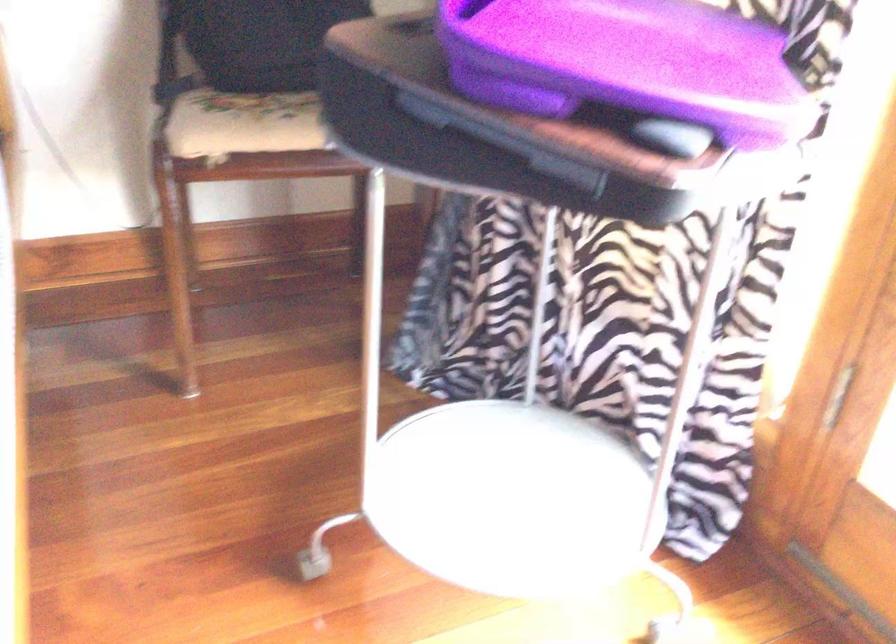
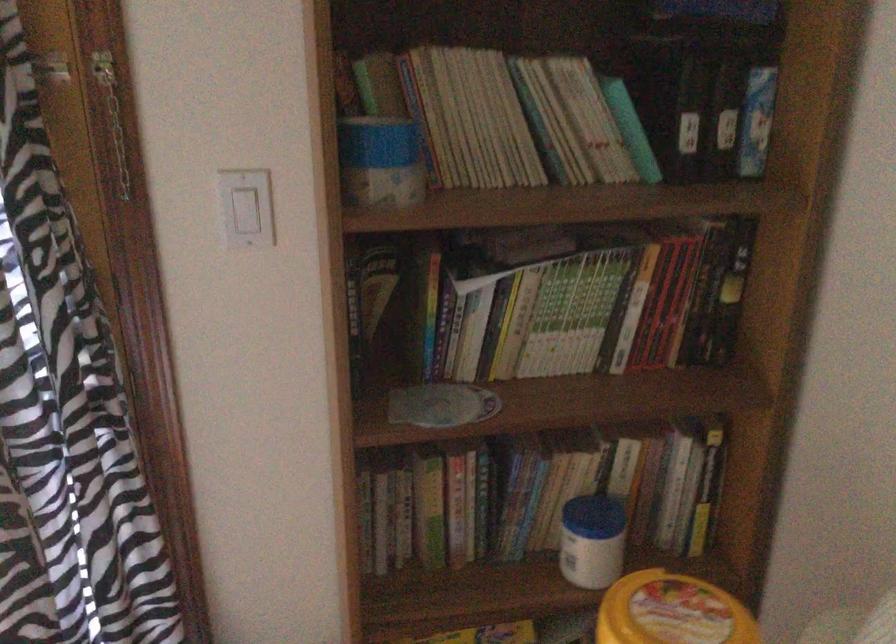
Based on the photo, based on the continuous images, in which direction is the camera rotating?

The rotation direction of the camera is right-down.